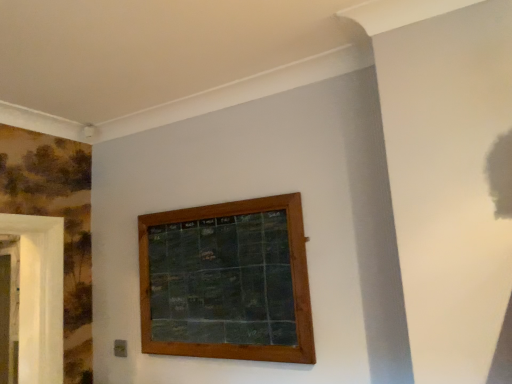
Describe the element at coordinates (227, 282) in the screenshot. The image size is (512, 384). I see `green slate calendar at center` at that location.

The image size is (512, 384). I want to click on green slate calendar at center, so click(227, 282).

Image resolution: width=512 pixels, height=384 pixels. Find the location of `green slate calendar at center`. green slate calendar at center is located at coordinates (227, 282).